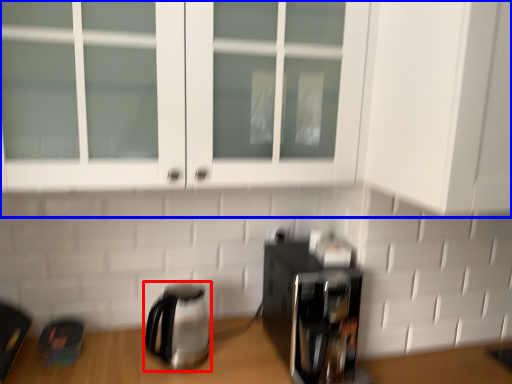
Question: Among these objects, which one is farthest to the camera, kettle (highlighted by a red box) or cabinetry (highlighted by a blue box)?

Choices:
 (A) kettle
 (B) cabinetry

Answer: (A)